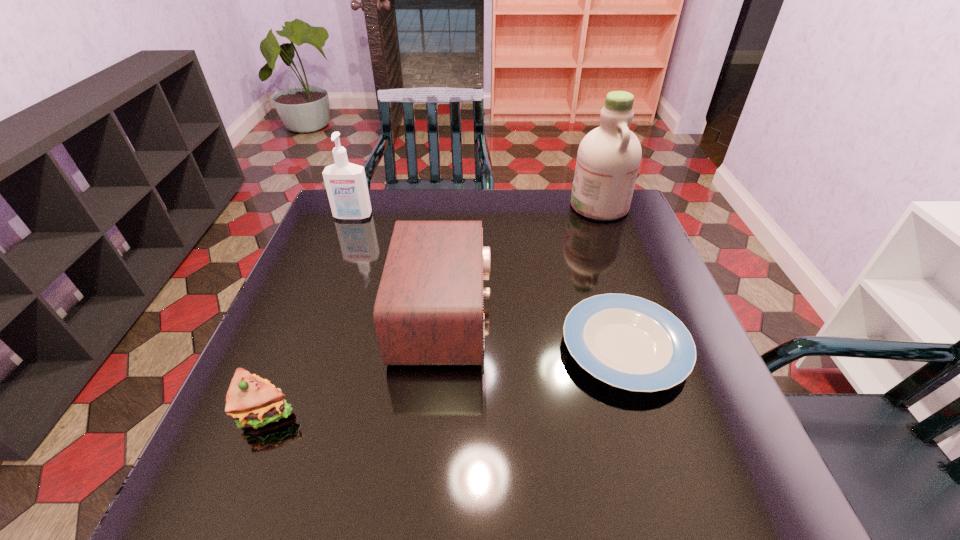
Find the location of a particular element. The image size is (960, 540). vacant area in the image that satisfies the following two spatial constraints: 1. on the front label of the shortest object; 2. on the right side of the left cleansing agent is located at coordinates (301, 347).

The height and width of the screenshot is (540, 960). In order to click on free location that satisfies the following two spatial constraints: 1. on the front panel of the third object from left to right; 2. on the front side of the sandwich in this screenshot , I will do `click(435, 411)`.

Find the location of `vacant position in the image that satisfies the following two spatial constraints: 1. on the front label of the right cleansing agent; 2. on the front label of the shorter cleansing agent`. vacant position in the image that satisfies the following two spatial constraints: 1. on the front label of the right cleansing agent; 2. on the front label of the shorter cleansing agent is located at coordinates pyautogui.click(x=603, y=217).